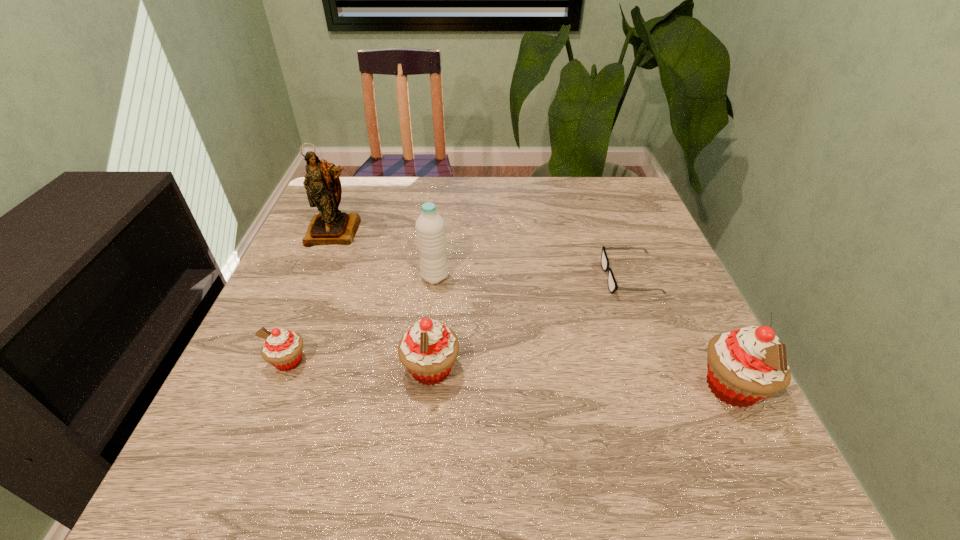
Find the location of a particular element. This screenshot has height=540, width=960. free spot between the figurine and the water bottle is located at coordinates (385, 254).

The height and width of the screenshot is (540, 960). What are the coordinates of `vacant area that lies between the water bottle and the tallest object` in the screenshot? It's located at (385, 254).

Identify the location of unoccupied position between the fifth tallest object and the rightmost cupcake. (511, 374).

At what (x,y) coordinates should I click in order to perform the action: click on free space between the shortest cupcake and the water bottle. Please return your answer as a coordinate pair (x, y). Looking at the image, I should click on (362, 319).

Locate an element on the screen. The height and width of the screenshot is (540, 960). vacant area that lies between the shortest object and the rightmost cupcake is located at coordinates (681, 333).

Where is `free space that is in between the rightmost cupcake and the spectacles`? free space that is in between the rightmost cupcake and the spectacles is located at coordinates (681, 333).

Where is `unoccupied position between the figurine and the fifth tallest object`? unoccupied position between the figurine and the fifth tallest object is located at coordinates (312, 296).

Identify the location of blank region between the fifth tallest object and the tallest object. This screenshot has height=540, width=960. (312, 296).

Identify the location of object identified as the third closest to the shortest object. (430, 227).

Identify which object is the third nearest to the fourth tallest object. Please provide its 2D coordinates. Your answer should be formatted as a tuple, i.e. [(x, y)], where the tuple contains the x and y coordinates of a point satisfying the conditions above.

[(612, 284)]